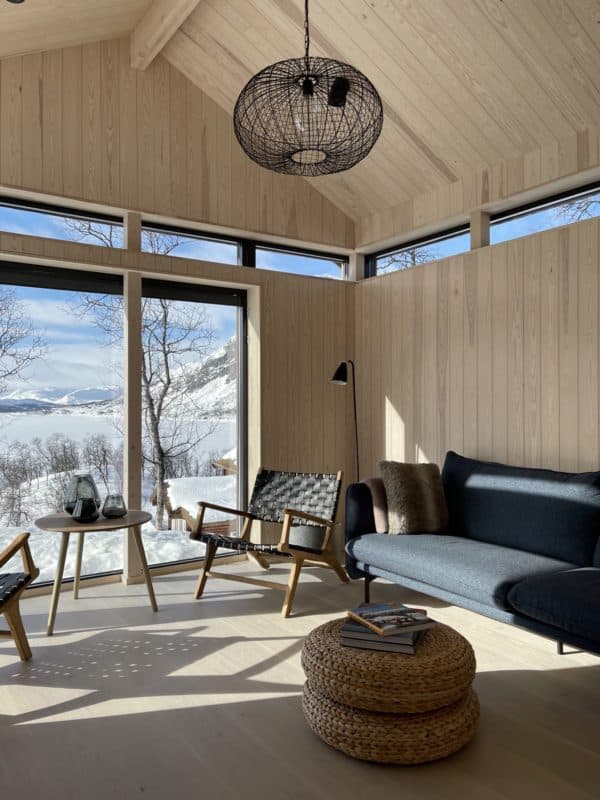
This screenshot has width=600, height=800. Identify the location of pillow. (425, 508).